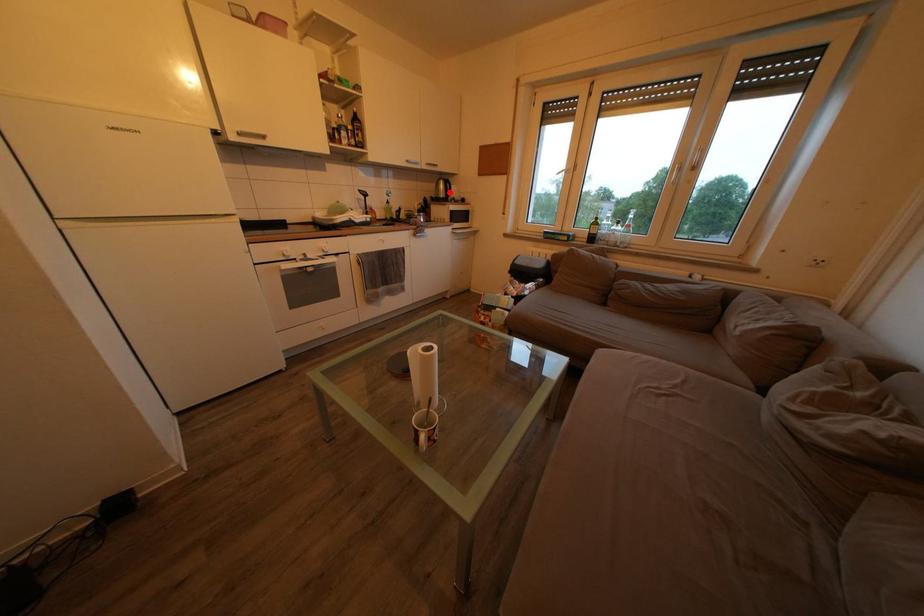
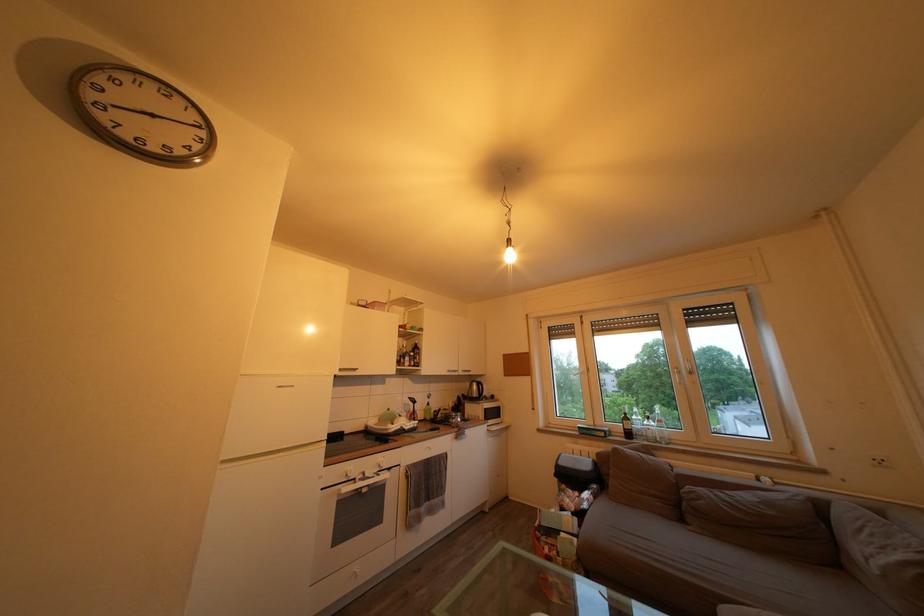
Where in the second image is the point corresponding to the highlighted location from the first image?

(482, 392)